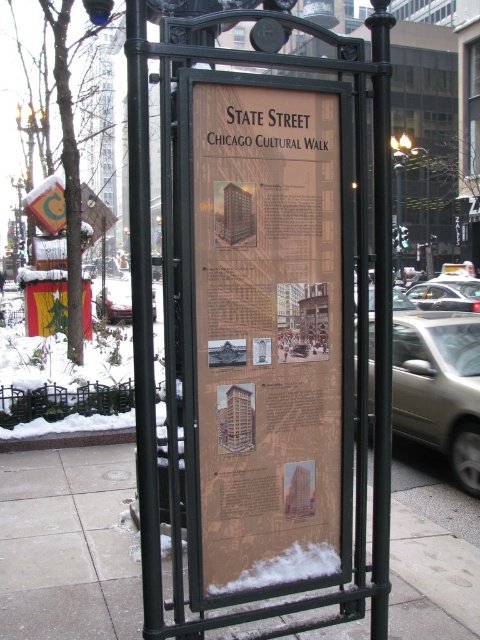
Looking at this image, you are a photographer standing at the edge of State Street Chicago Cultural Walk, holding a camera with a 50mm lens. You want to take a photo of the matte brown sign at center so that it fills the frame without cropping. Given that the camera requires the subject to be at least 8 feet away to avoid distortion, is the current distance sufficient?

The matte brown sign at center is currently 7.60 feet away from the camera. Since the camera requires the photographer to be at least 8 feet away to avoid distortion, the current distance is insufficient. The photographer needs to move back approximately 0.4 feet to achieve the required distance.

You are a delivery person with a cart that is 3 feet wide. You need to pass between the smooth concrete pavement at center and the black metal pole at center. Will your cart fit through the space between them?

The smooth concrete pavement at center is 3.48 feet from the black metal pole at center. Since your cart is 3 feet wide, it will fit through the space between them as 3.48 feet is wider than 3 feet.

You are a delivery person trying to park your 1.2 meter wide cart on the smooth concrete pavement at center. The black metal pole at center is in the way. Can you park your cart there without hitting the pole?

The smooth concrete pavement at center is wider than the black metal pole at center, so yes, you can park your 1.2 meter wide cart on the smooth concrete pavement at center without hitting the pole since the pavement is wider than the pole.